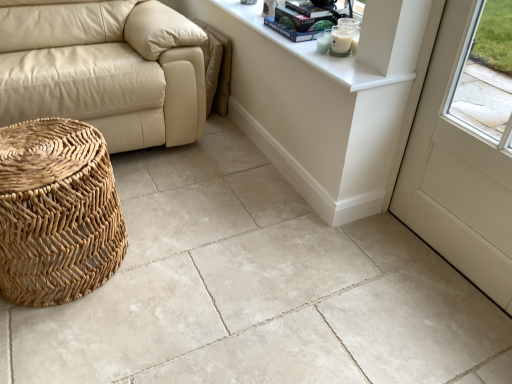
Identify the location of free spot behind natural woven basket at lower left. (147, 193).